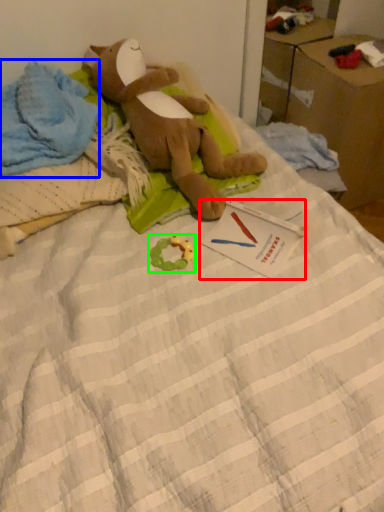
Question: Considering the real-world distances, which object is closest to postcard (highlighted by a red box)? clothing (highlighted by a blue box) or toy (highlighted by a green box).

Choices:
 (A) clothing
 (B) toy

Answer: (B)